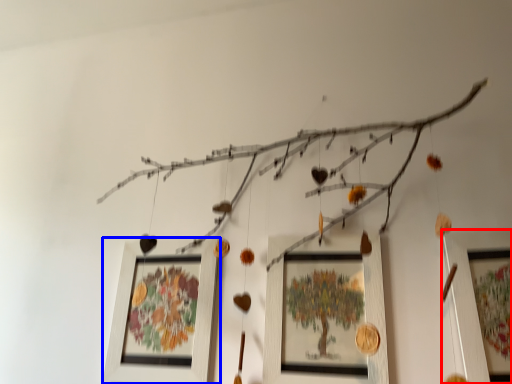
Question: Which of the following is the farthest to the observer, picture frame (highlighted by a red box) or picture frame (highlighted by a blue box)?

Choices:
 (A) picture frame
 (B) picture frame

Answer: (B)